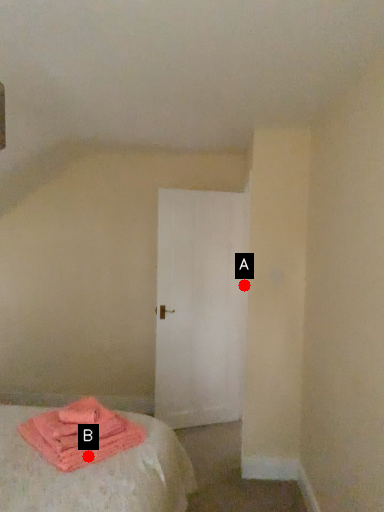
Question: Two points are circled on the image, labeled by A and B beside each circle. Among these points, which one is farthest from the camera?

Choices:
 (A) A is further
 (B) B is further

Answer: (A)